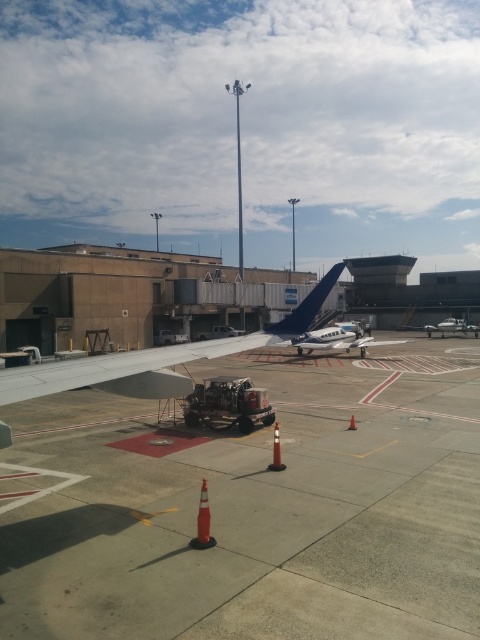
You are a baggage cart driver who needs to navigate between the orange reflective cone at lower center and the orange rubber cone at center. The cart is 2 meters wide. Is there enough space for the cart to pass through the gap between them?

The gap between the orange reflective cone at lower center and the orange rubber cone at center is 2.56 meters. Since the cart is 2 meters wide, there is sufficient space for the cart to pass through the gap.

You are a pilot preparing to taxi your plane to the runway. You need to navigate around the blue matte airplane tail at center. Based on its position coordinates, can you estimate how far you should steer your plane to avoid collision?

The blue matte airplane tail at center is located at coordinates point [308,305], so you should steer your plane to the right or left to maintain a safe distance from its position.

You are a pilot preparing for takeoff and need to ensure there are no obstacles taller than your aircraft in your path. You notice the metallic blue airplane at center and the orange reflective cone at lower center. Which object is taller and could potentially block your flight path?

The metallic blue airplane at center is taller than the orange reflective cone at lower center, so it could potentially block your flight path.